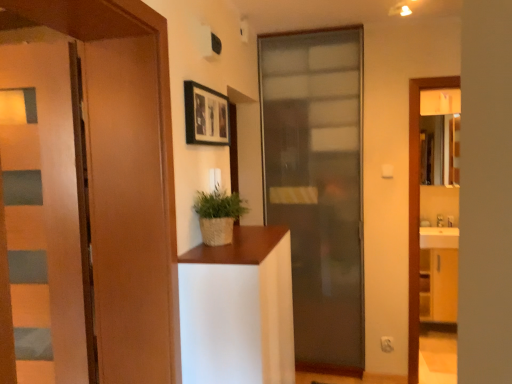
I want to click on free space in front of braided straw pot at center, so click(216, 254).